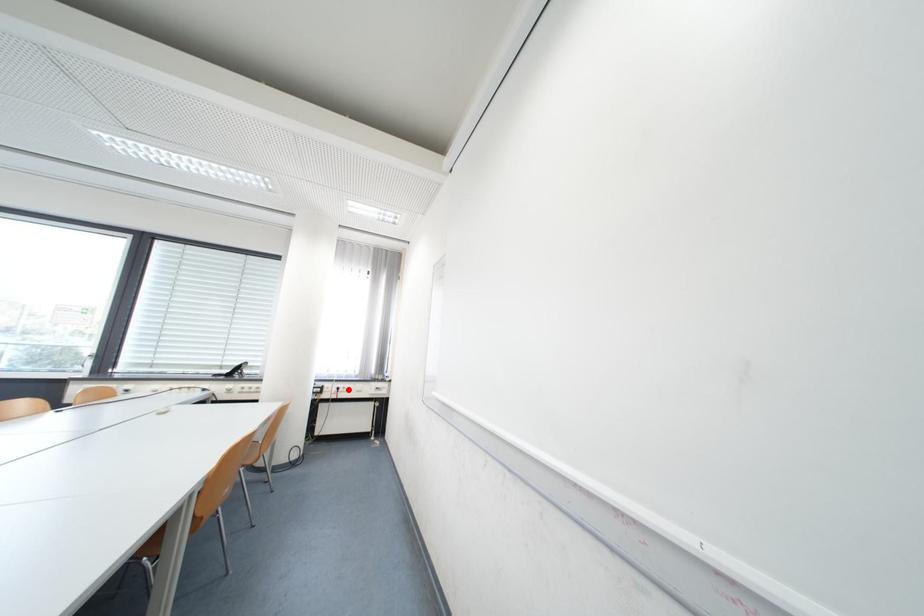
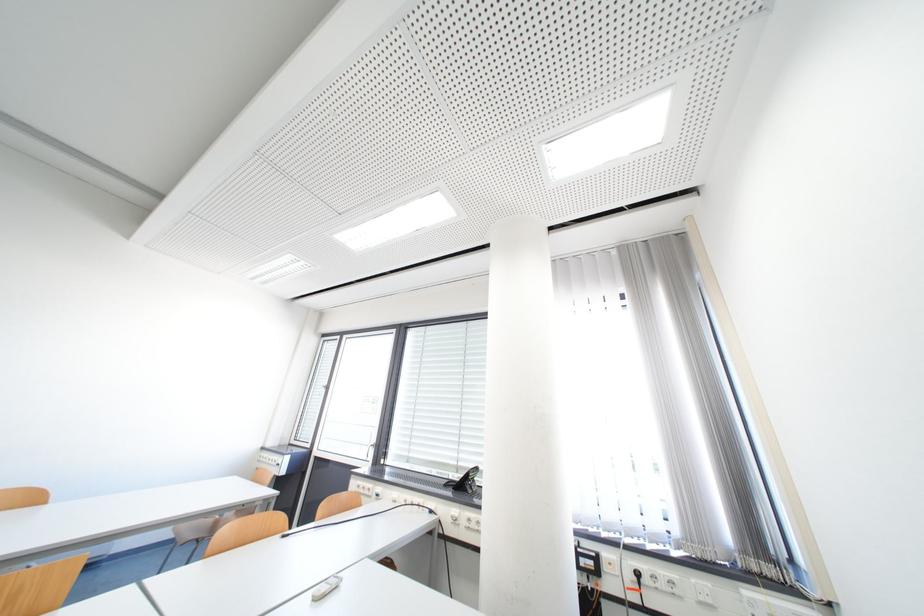
Question: I am providing you with two images of the same scene from different viewpoints. Given a red point in image1, look at the same physical point in image2. Is it:

Choices:
 (A) Closer to the viewpoint
 (B) Farther from the viewpoint

Answer: (A)